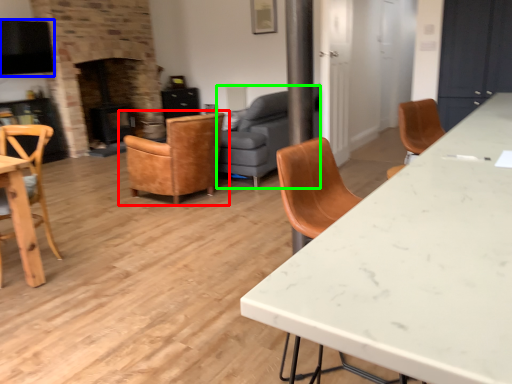
Question: Which is nearer to the chair (highlighted by a red box)? exhaust hood (highlighted by a blue box) or studio couch (highlighted by a green box).

Choices:
 (A) exhaust hood
 (B) studio couch

Answer: (B)